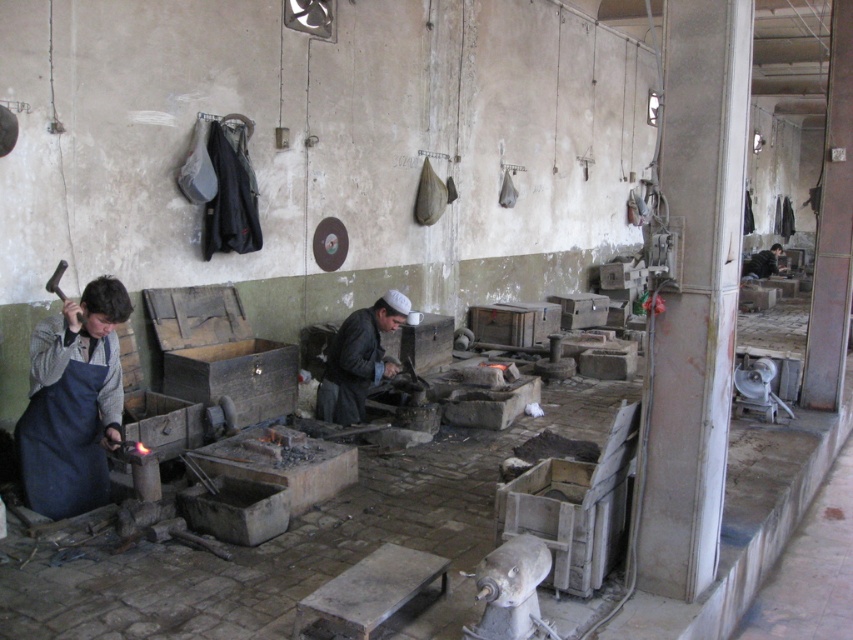
Is point (326, 374) more distant than point (753, 269)?

No, (326, 374) is closer to viewer.

Does dark gray leather jacket at center have a smaller size compared to dark blue apron at center?

Yes, dark gray leather jacket at center is smaller than dark blue apron at center.

Describe the element at coordinates (358, 358) in the screenshot. I see `dark gray leather jacket at center` at that location.

Image resolution: width=853 pixels, height=640 pixels. In order to click on dark gray leather jacket at center in this screenshot , I will do pyautogui.click(x=358, y=358).

Can you confirm if blue apron at left is bigger than dark blue apron at center?

No, blue apron at left is not bigger than dark blue apron at center.

Which is behind, point (128, 300) or point (747, 260)?

The point (747, 260) is behind.

The image size is (853, 640). Describe the element at coordinates (73, 403) in the screenshot. I see `blue apron at left` at that location.

This screenshot has width=853, height=640. In order to click on blue apron at left in this screenshot , I will do (x=73, y=403).

Who is shorter, blue apron at left or dark gray leather jacket at center?

dark gray leather jacket at center is shorter.

Is point (120, 291) farther from camera compared to point (334, 378)?

That is False.

Which is in front, point (51, 480) or point (360, 406)?

Positioned in front is point (51, 480).

The image size is (853, 640). Identify the location of blue apron at left. click(73, 403).